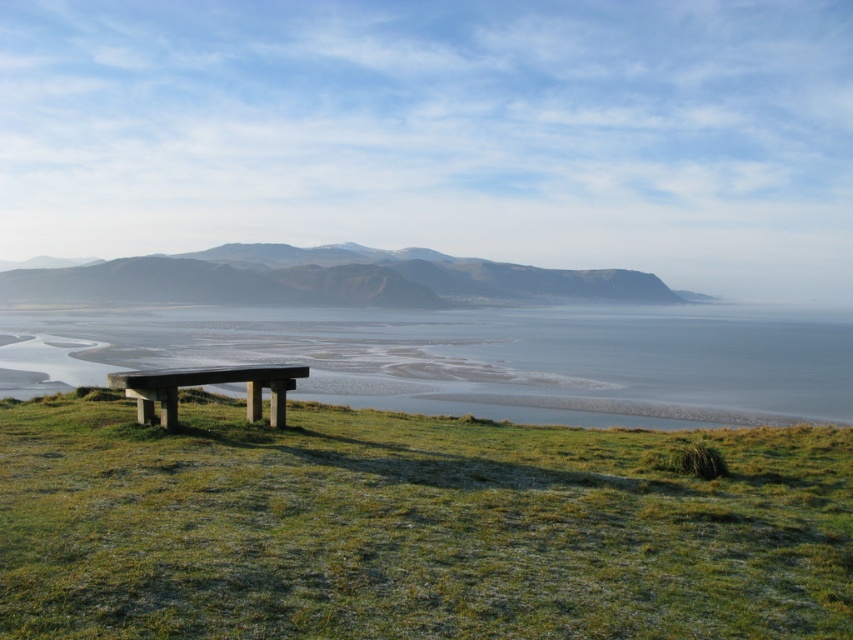
You are sitting on the smooth concrete bench at lower left and want to look at the clear water at bench left. Which direction should you turn your head to see it?

The clear water at bench left is further to the viewer than the smooth concrete bench at lower left, so you should turn your head to the left to see it.

You are standing at the wooden bench on the grassy area and want to take a photo of the distant sea. There are two points in your viewfinder labeled as point 1 at coordinates point (686, 310) and point 2 at coordinates point (699, 298). Which point should you focus on to ensure the foreground bench is sharp while capturing the distant sea?

You should focus on point 1 at coordinates point (686, 310) because it is closer to the camera than point 2 at coordinates point (699, 298). This ensures the bench in the foreground remains sharp while still capturing the distant sea.

You are standing at the smooth concrete bench at lower left and want to walk towards the green grassy hillside at center. Which direction should you move to reach it?

To reach the green grassy hillside at center from the smooth concrete bench at lower left, you should move to the right since the green grassy hillside at center is positioned on the left side of the smooth concrete bench at lower left.